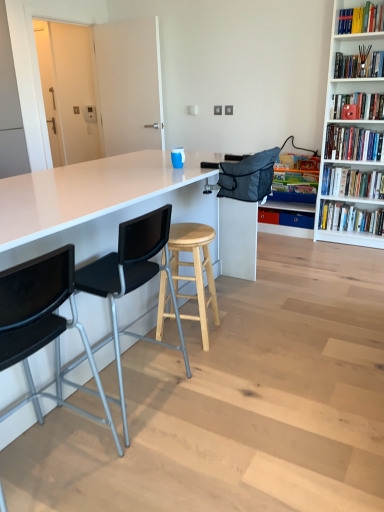
Question: From the image's perspective, would you say blue plastic drawer at center is positioned over matte red bookshelf at upper right, the 5th book when ordered from bottom to top?

Choices:
 (A) yes
 (B) no

Answer: (B)

Question: From the image's perspective, is blue plastic drawer at center below matte red bookshelf at upper right, the 5th book when ordered from bottom to top?

Choices:
 (A) yes
 (B) no

Answer: (A)

Question: Considering the relative sizes of blue plastic drawer at center and matte red bookshelf at upper right, the 5th book when ordered from bottom to top, in the image provided, is blue plastic drawer at center wider than matte red bookshelf at upper right, the 5th book when ordered from bottom to top,?

Choices:
 (A) no
 (B) yes

Answer: (A)

Question: From a real-world perspective, is blue plastic drawer at center beneath matte red bookshelf at upper right, which is the 3th book from top to bottom?

Choices:
 (A) no
 (B) yes

Answer: (B)

Question: Would you consider blue plastic drawer at center to be distant from matte red bookshelf at upper right, which is the 3th book from top to bottom?

Choices:
 (A) yes
 (B) no

Answer: (A)

Question: From a real-world perspective, is white wooden bookcase at upper right physically located above or below hardcover books at upper right, placed as the 4th book when sorted from top to bottom?

Choices:
 (A) below
 (B) above

Answer: (B)

Question: Considering the relative positions of white wooden bookcase at upper right and hardcover books at upper right, placed as the 4th book when sorted from top to bottom, in the image provided, is white wooden bookcase at upper right to the left or to the right of hardcover books at upper right, placed as the 4th book when sorted from top to bottom,?

Choices:
 (A) left
 (B) right

Answer: (B)

Question: From the image's perspective, relative to hardcover books at upper right, placed as the 4th book when sorted from top to bottom, is white wooden bookcase at upper right above or below?

Choices:
 (A) above
 (B) below

Answer: (A)

Question: Considering the positions of white wooden bookcase at upper right and hardcover books at upper right, which is the fourth book from bottom to top, in the image, is white wooden bookcase at upper right bigger or smaller than hardcover books at upper right, which is the fourth book from bottom to top,?

Choices:
 (A) small
 (B) big

Answer: (B)

Question: Is black plastic chair at left, which is the first chair in front-to-back order, wider or thinner than white paperback book at upper right, which is the 2th book from bottom to top?

Choices:
 (A) thin
 (B) wide

Answer: (B)

Question: Based on their sizes in the image, would you say black plastic chair at left, arranged as the second chair when viewed from the back, is bigger or smaller than white paperback book at upper right, which is the 2th book from bottom to top?

Choices:
 (A) big
 (B) small

Answer: (A)

Question: From a real-world perspective, is black plastic chair at left, which is the first chair in front-to-back order, positioned above or below white paperback book at upper right, which is the 2th book from bottom to top?

Choices:
 (A) above
 (B) below

Answer: (B)

Question: Is black plastic chair at left, arranged as the second chair when viewed from the back, in front of or behind white paperback book at upper right, placed as the 6th book when sorted from top to bottom, in the image?

Choices:
 (A) front
 (B) behind

Answer: (A)

Question: In the image, is white paperback book at upper right, placed as the 6th book when sorted from top to bottom, positioned in front of or behind black plastic chair at left, which is the first chair in front-to-back order?

Choices:
 (A) front
 (B) behind

Answer: (B)

Question: Choose the correct answer: Is white paperback book at upper right, which is the 2th book from bottom to top, inside black plastic chair at left, which is the first chair in front-to-back order, or outside it?

Choices:
 (A) outside
 (B) inside

Answer: (A)